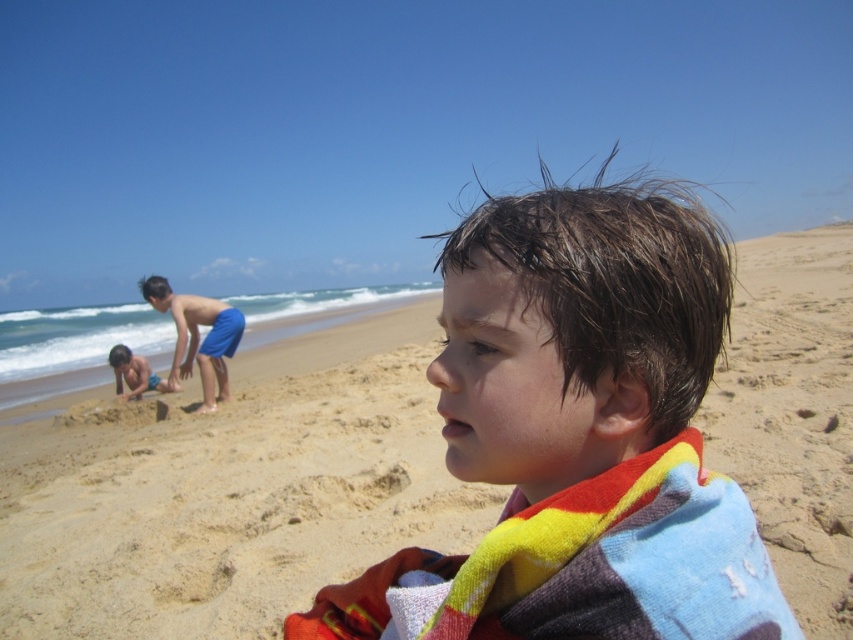
Who is lower down, blue shorts at center or blue shorts at lower left?

blue shorts at lower left is lower down.

Does point (148, 278) lie in front of point (119, 388)?

Yes, it is.

You are a GUI agent. You are given a task and a screenshot of the screen. Output one action in this format:
    pyautogui.click(x=<x>, y=<y>)
    Task: Click on the blue shorts at center
    The height and width of the screenshot is (640, 853).
    Given the screenshot: What is the action you would take?
    pyautogui.click(x=196, y=337)

Between wet hair towel at center and blue shorts at center, which one is positioned higher?

blue shorts at center

Does point (659, 268) come farther from viewer compared to point (212, 364)?

No, it is in front of (212, 364).

Does point (699, 323) come closer to viewer compared to point (222, 326)?

Yes, it is in front of point (222, 326).

This screenshot has height=640, width=853. Find the location of `wet hair towel at center`. wet hair towel at center is located at coordinates (579, 435).

Does wet hair towel at center have a greater height compared to blue shorts at lower left?

Yes, wet hair towel at center is taller than blue shorts at lower left.

Is point (558, 225) less distant than point (129, 349)?

Yes, point (558, 225) is in front of point (129, 349).

The width and height of the screenshot is (853, 640). Identify the location of wet hair towel at center. (579, 435).

Locate an element on the screen. wet hair towel at center is located at coordinates (579, 435).